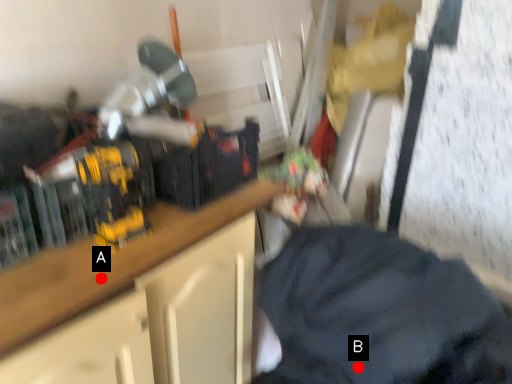
Question: Two points are circled on the image, labeled by A and B beside each circle. Which of the following is the closest to the observer?

Choices:
 (A) A is closer
 (B) B is closer

Answer: (B)